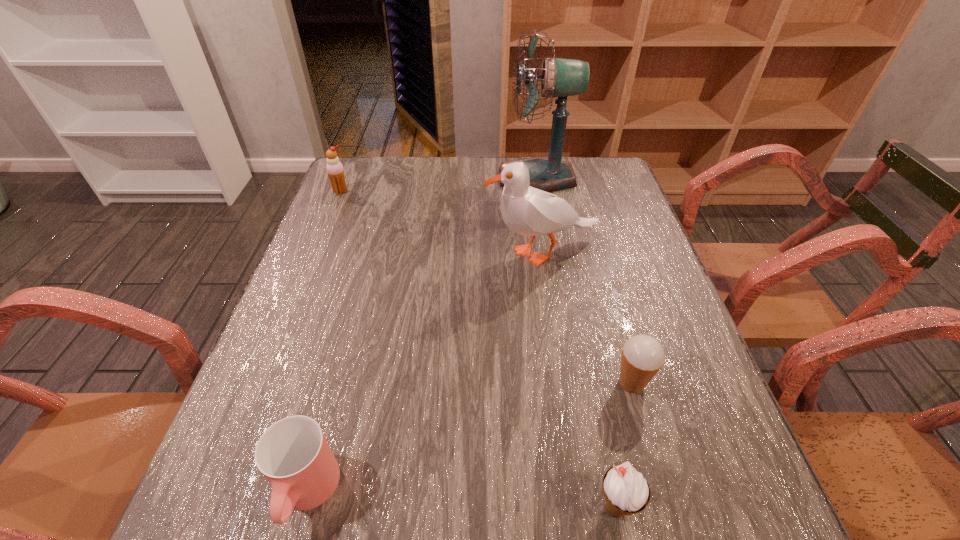
You are a GUI agent. You are given a task and a screenshot of the screen. Output one action in this format:
    pyautogui.click(x=<x>, y=<y>)
    Task: Click on the object at the left edge
    The height and width of the screenshot is (540, 960).
    Given the screenshot: What is the action you would take?
    pyautogui.click(x=335, y=171)

This screenshot has width=960, height=540. In order to click on fan present at the right edge in this screenshot , I will do `click(561, 78)`.

Where is `gull at the right edge`? The image size is (960, 540). gull at the right edge is located at coordinates (528, 211).

Locate an element on the screen. icecream that is at the right edge is located at coordinates (643, 356).

You are a GUI agent. You are given a task and a screenshot of the screen. Output one action in this format:
    pyautogui.click(x=<x>, y=<y>)
    Task: Click on the object at the far left corner
    
    Given the screenshot: What is the action you would take?
    pyautogui.click(x=335, y=171)

The height and width of the screenshot is (540, 960). I want to click on object situated at the far right corner, so click(x=561, y=78).

Find the location of a particular element. The image size is (960, 540). vacant space at the far edge of the desktop is located at coordinates (437, 177).

Identify the location of free space at the left edge of the desktop. (339, 355).

In the image, there is a desktop. Where is `vacant area at the right edge`? vacant area at the right edge is located at coordinates (660, 417).

In the image, there is a desktop. What are the coordinates of `vacant space at the near left corner` in the screenshot? It's located at (203, 495).